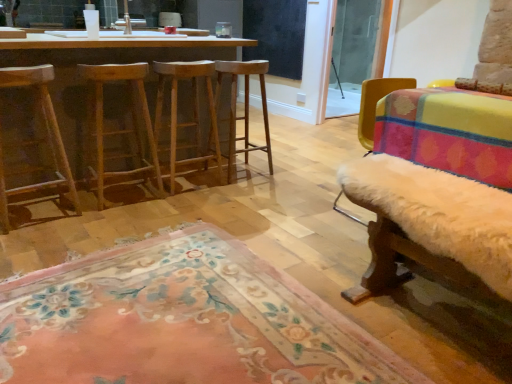
Where is `spots to the right of wooden stool at center, marked as the first stool in a right-to-left arrangement`? This screenshot has height=384, width=512. spots to the right of wooden stool at center, marked as the first stool in a right-to-left arrangement is located at coordinates (277, 174).